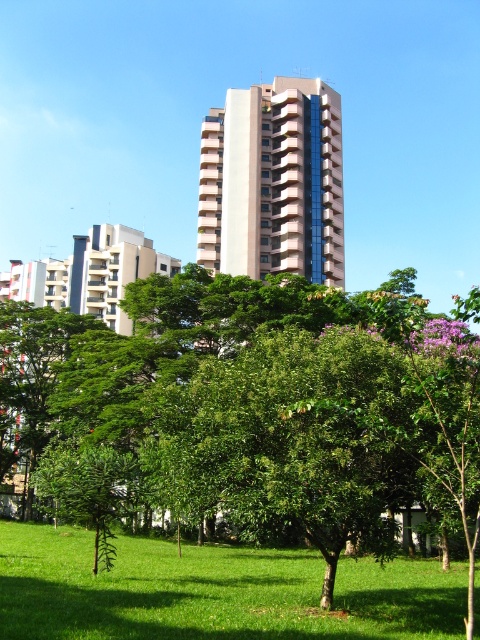
You are a city planner assessing the urban space. You need to determine if the green leafy tree at center will block the view of the white glossy building at center from the grassy area in front. Can you confirm if the tree is shorter than the building?

The green leafy tree at center has a lesser height compared to white glossy building at center, so yes, the tree is shorter than the building. This means the tree will not block the view of the white glossy building at center from the grassy area in front.

You are a city planner assessing the urban space. You need to determine if the green leafy tree at center is large enough to provide shade for the white glossy building at center. Based on their sizes, can the tree shade the building?

The green leafy tree at center is bigger than the white glossy building at center, so it is likely that the tree can provide sufficient shade for the building.